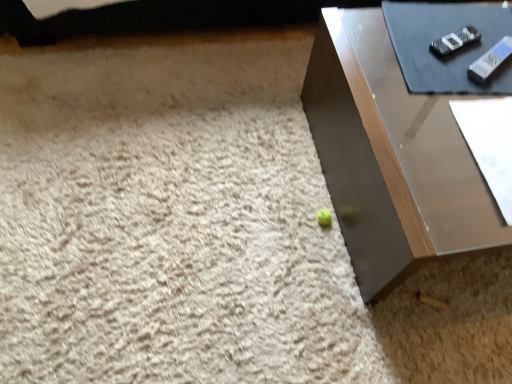
Question: Should I look upward or downward to see shiny brown table at lower right?

Choices:
 (A) up
 (B) down

Answer: (A)